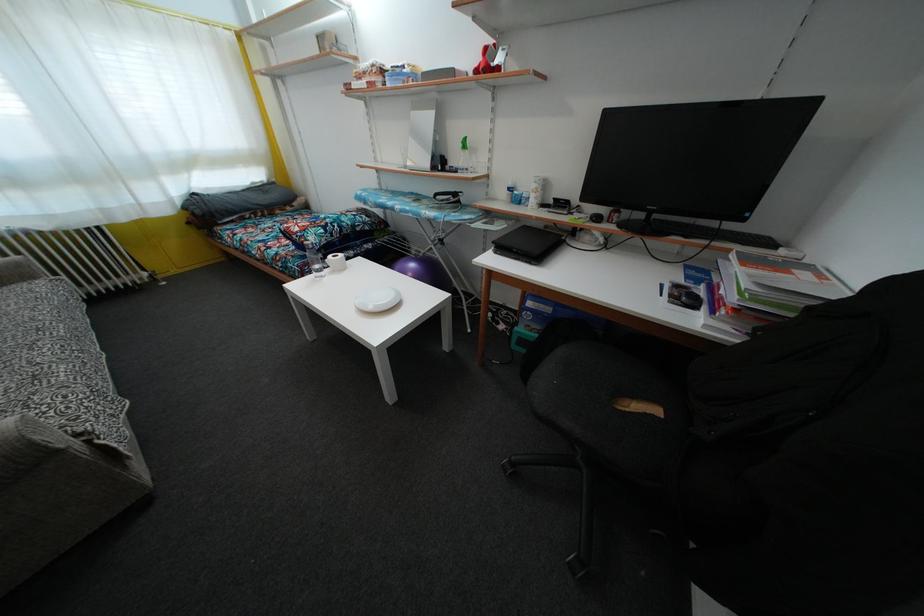
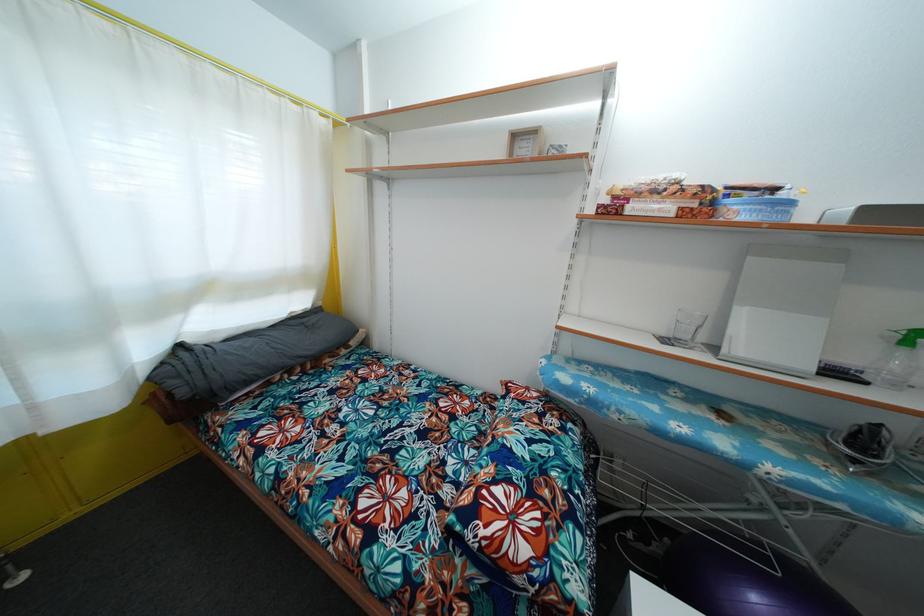
Find the pixel in the second image that matches [377,71] in the first image.

(683, 188)